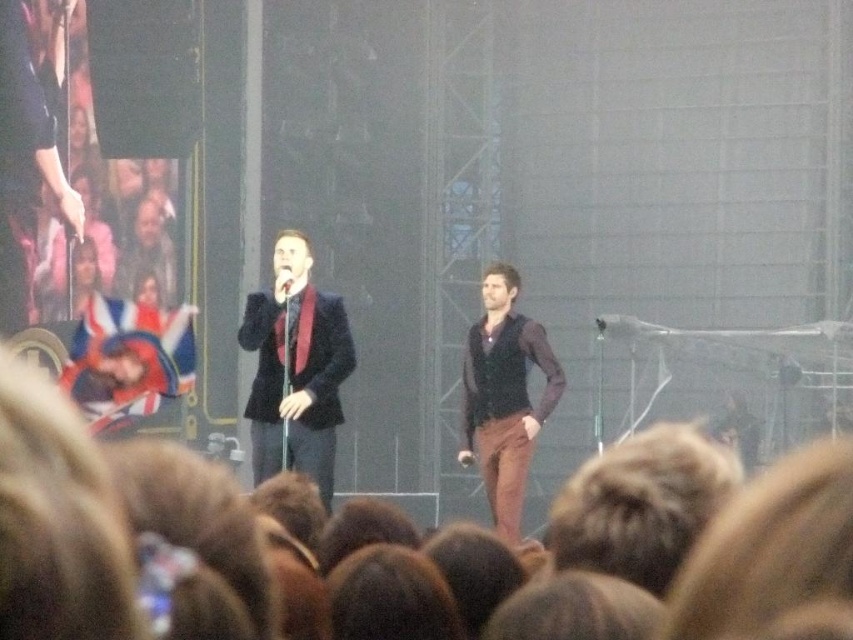
Question: Which object appears farthest from the camera in this image?

Choices:
 (A) matte black suit at center
 (B) brown hair at lower center

Answer: (A)

Question: Which is farther from the brown hair at lower center?

Choices:
 (A) matte black suit at center
 (B) metallic silver microphone at center
 (C) brown velvet vest at center

Answer: (C)

Question: In this image, where is brown hair at lower center located relative to matte black suit at center?

Choices:
 (A) left
 (B) right

Answer: (B)

Question: Is matte black suit at center wider than brown velvet vest at center?

Choices:
 (A) no
 (B) yes

Answer: (B)

Question: Does brown hair at lower center have a smaller size compared to metallic silver microphone at center?

Choices:
 (A) yes
 (B) no

Answer: (B)

Question: Which object is farther from the camera taking this photo?

Choices:
 (A) metallic silver microphone at center
 (B) matte black suit at center

Answer: (A)